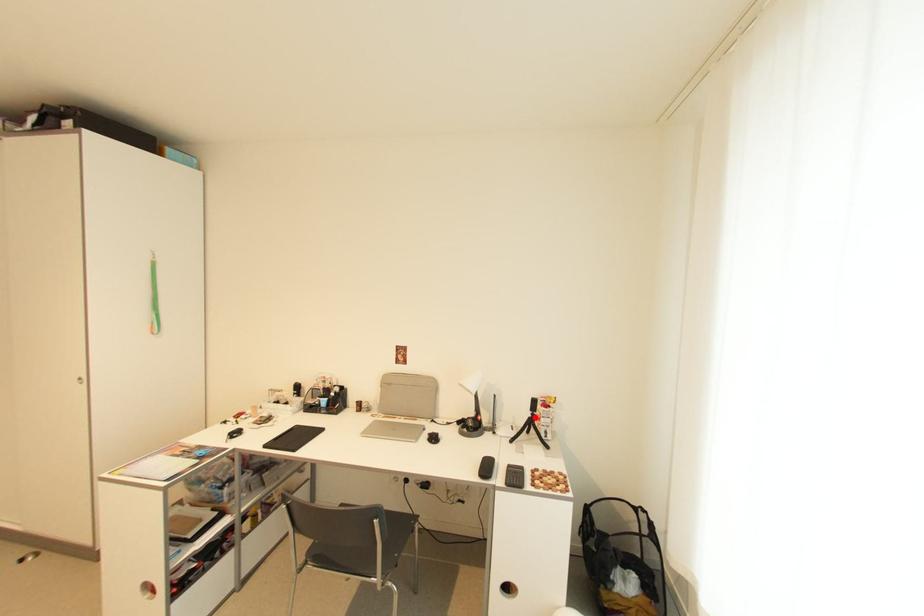
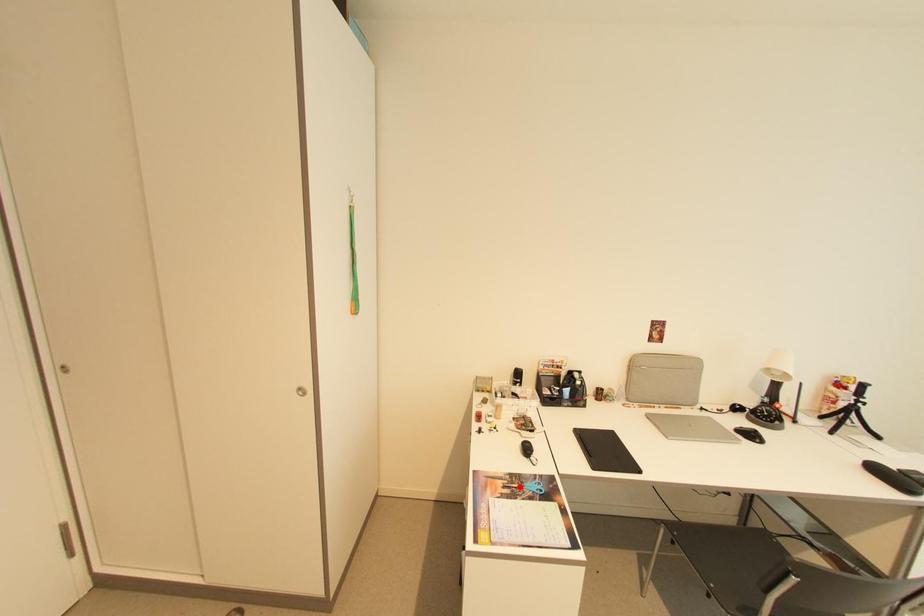
I am providing you with two images of the same scene from different viewpoints. A red point is marked on the first image and another point is marked on the second image. Are the points marked in image1 and image2 representing the same 3D position?

No